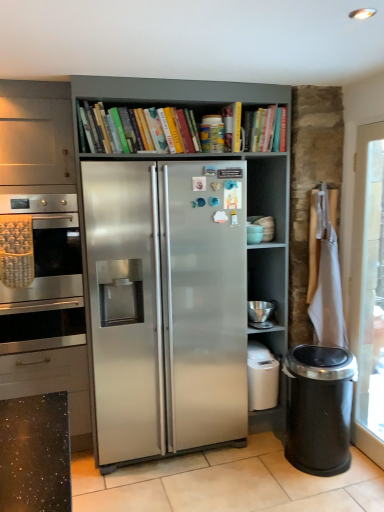
Locate an element on the screen. vacant position to the left of black plastic trash can at lower right is located at coordinates (262, 467).